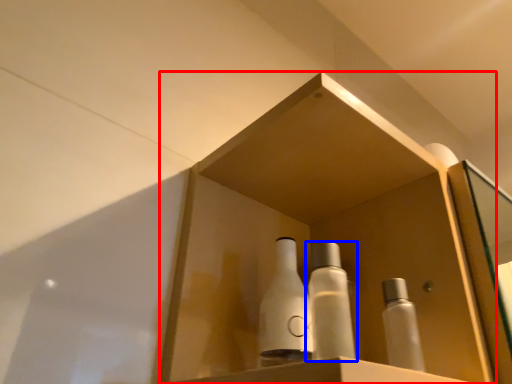
Question: Which point is closer to the camera, shelf (highlighted by a red box) or bottle (highlighted by a blue box)?

Choices:
 (A) shelf
 (B) bottle

Answer: (A)